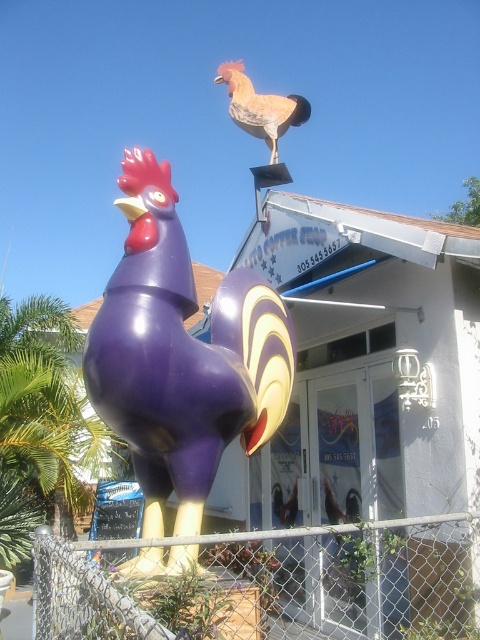
Question: Which object is the farthest from the chain link fence at lower center?

Choices:
 (A) purple glossy rooster at lower left
 (B) matte orange rooster at upper center

Answer: (B)

Question: Is chain link fence at lower center to the right of matte orange rooster at upper center from the viewer's perspective?

Choices:
 (A) no
 (B) yes

Answer: (B)

Question: Which is nearer to the chain link fence at lower center?

Choices:
 (A) matte orange rooster at upper center
 (B) purple glossy rooster at lower left

Answer: (B)

Question: Does chain link fence at lower center appear on the left side of matte orange rooster at upper center?

Choices:
 (A) no
 (B) yes

Answer: (A)

Question: Does purple glossy rooster at lower left appear under matte orange rooster at upper center?

Choices:
 (A) no
 (B) yes

Answer: (B)

Question: Which point is farther from the camera taking this photo?

Choices:
 (A) (411, 602)
 (B) (173, 221)
 (C) (286, 102)

Answer: (C)